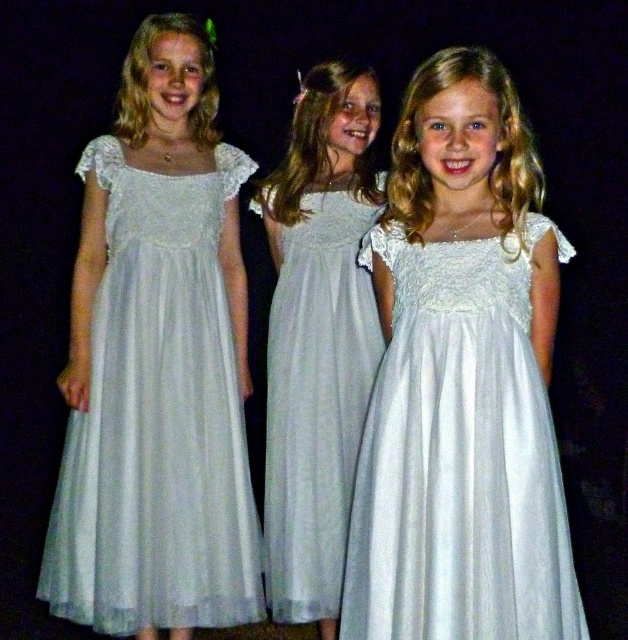
Question: Does white sheer dress at left lie in front of white satin dress at center?

Choices:
 (A) yes
 (B) no

Answer: (B)

Question: Which point is closer to the camera taking this photo?

Choices:
 (A) (453, 504)
 (B) (138, 538)
 (C) (269, 429)

Answer: (A)

Question: Which point is closer to the camera?

Choices:
 (A) pos(556,504)
 (B) pos(278,387)
 (C) pos(171,474)

Answer: (A)

Question: Is white sheer dress at left bigger than white sheer dress at center?

Choices:
 (A) no
 (B) yes

Answer: (B)

Question: Which point is closer to the camera?

Choices:
 (A) white satin dress at center
 (B) white sheer dress at left

Answer: (A)

Question: Can you confirm if white satin dress at center is smaller than white sheer dress at center?

Choices:
 (A) no
 (B) yes

Answer: (A)